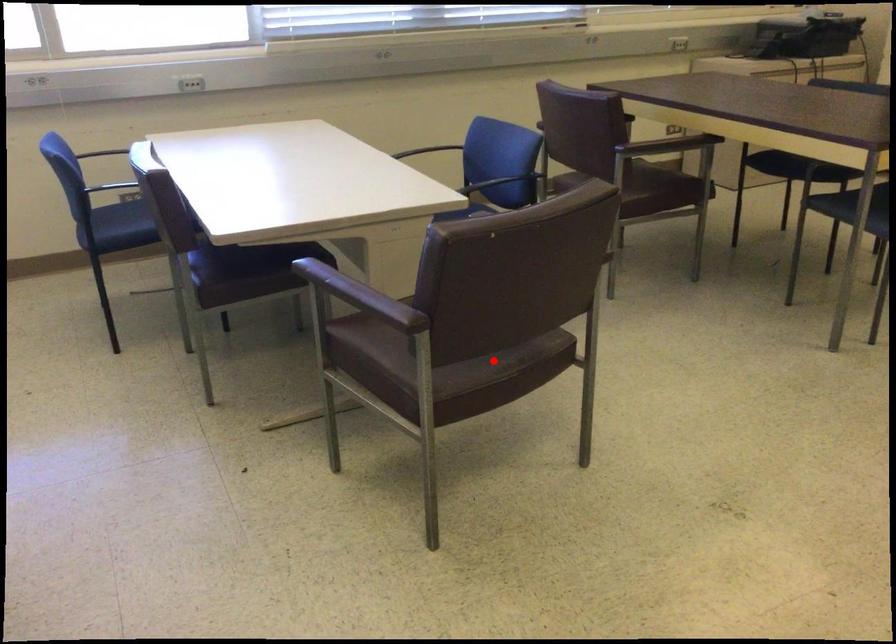
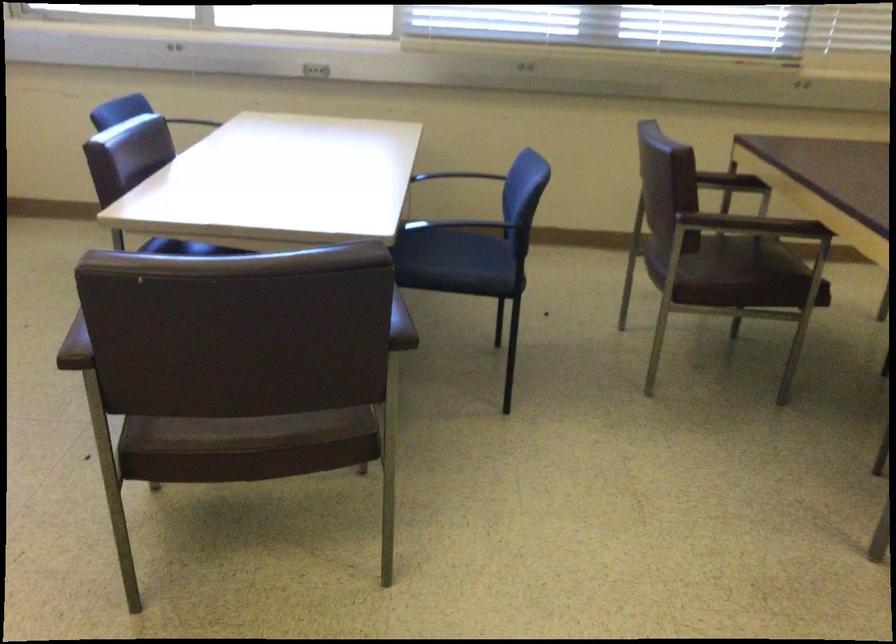
Question: I am providing you with two images of the same scene from different viewpoints. A red point is shown in image1. For the corresponding object point in image2, is it positioned nearer or farther from the camera?

Choices:
 (A) Nearer
 (B) Farther

Answer: (A)